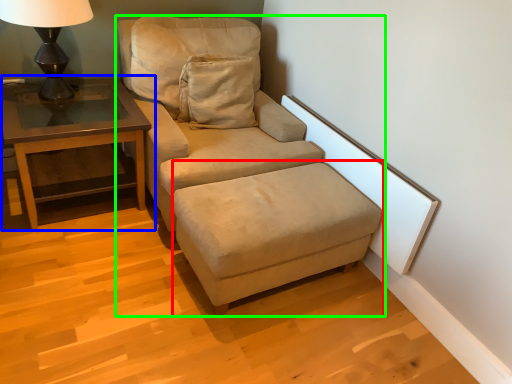
Question: Which is farther away from footrest (highlighted by a red box)? table (highlighted by a blue box) or studio couch (highlighted by a green box)?

Choices:
 (A) table
 (B) studio couch

Answer: (A)